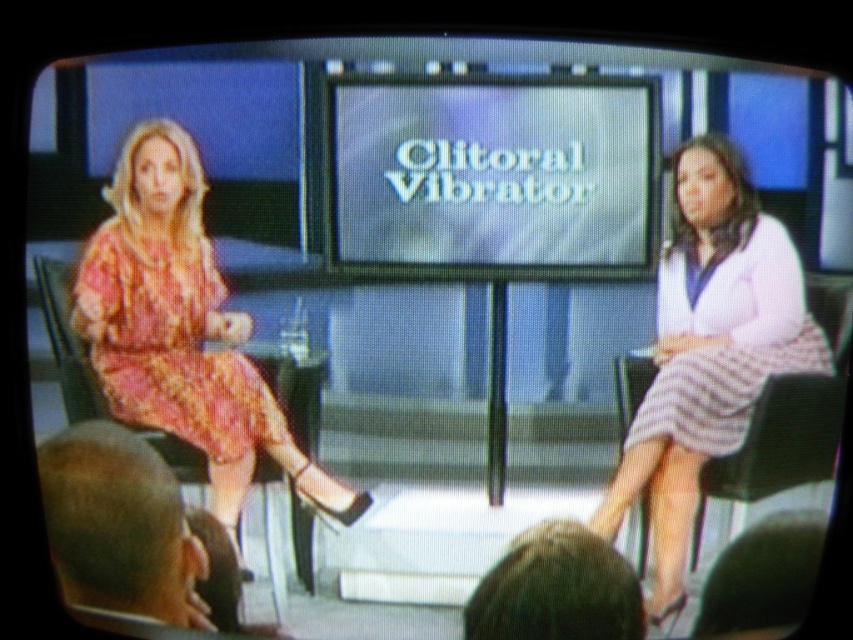
Does white glossy text at center have a greater width compared to floral dress at left?

Yes, white glossy text at center is wider than floral dress at left.

Measure the distance between white glossy text at center and camera.

white glossy text at center and camera are 4.34 feet apart.

This screenshot has height=640, width=853. Identify the location of white glossy text at center. (492, 170).

Is white glossy text at center smaller than white striped skirt at right?

Correct, white glossy text at center occupies less space than white striped skirt at right.

Measure the distance from white glossy text at center to white striped skirt at right.

white glossy text at center and white striped skirt at right are 5.58 inches apart from each other.

Which is behind, point (341, 179) or point (660, 324)?

Positioned behind is point (660, 324).

In order to click on white glossy text at center in this screenshot , I will do `click(492, 170)`.

Does white glossy text at center have a larger size compared to printed fabric dress at left?

No.

Can you confirm if white glossy text at center is thinner than printed fabric dress at left?

Incorrect, white glossy text at center's width is not less than printed fabric dress at left's.

Is point (550, 246) positioned in front of point (85, 316)?

Yes, point (550, 246) is closer to viewer.

In order to click on white glossy text at center in this screenshot , I will do `click(492, 170)`.